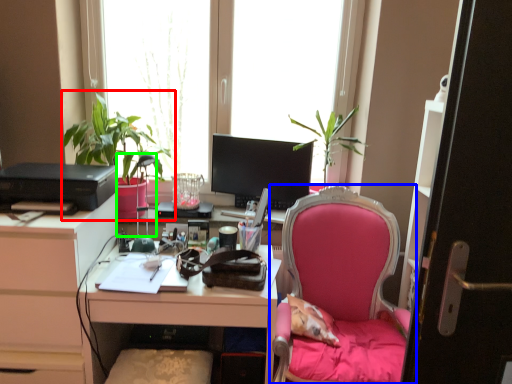
Question: Estimate the real-world distances between objects in this image. Which object is closer to houseplant (highlighted by a red box), chair (highlighted by a blue box) or lamp (highlighted by a green box)?

Choices:
 (A) chair
 (B) lamp

Answer: (B)